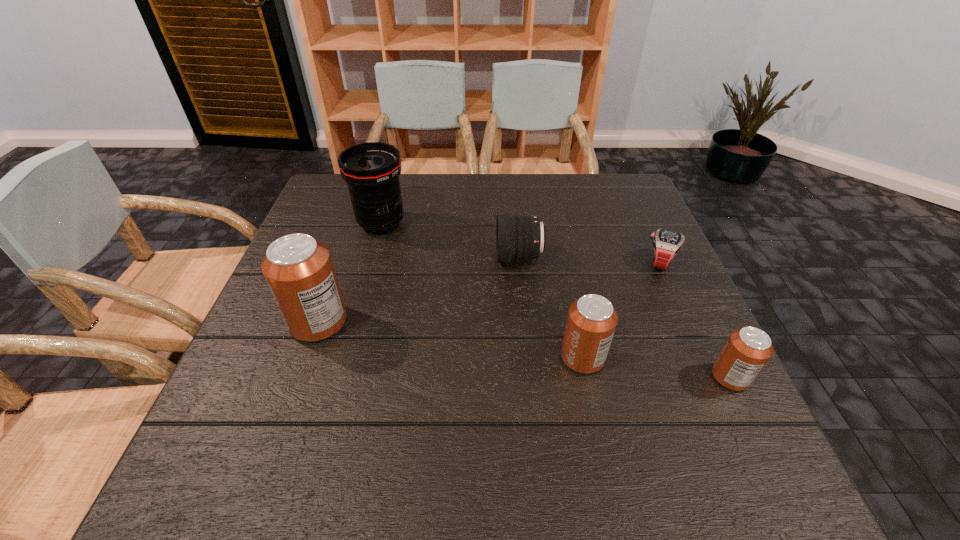
Identify the location of the tallest can. This screenshot has width=960, height=540. (298, 269).

Identify the location of the second shortest can. The width and height of the screenshot is (960, 540). (591, 322).

You are a GUI agent. You are given a task and a screenshot of the screen. Output one action in this format:
    pyautogui.click(x=<x>, y=<y>)
    Task: Click on the third tallest object
    
    Given the screenshot: What is the action you would take?
    pyautogui.click(x=591, y=322)

The image size is (960, 540). Identify the location of the rightmost can. (747, 350).

You are a GUI agent. You are given a task and a screenshot of the screen. Output one action in this format:
    pyautogui.click(x=<x>, y=<y>)
    Task: Click on the nearer telephoto lens
    This screenshot has height=540, width=960.
    Given the screenshot: What is the action you would take?
    pyautogui.click(x=518, y=237)

Identify the location of the shorter telephoto lens. The width and height of the screenshot is (960, 540). (518, 237).

At what (x,y) coordinates should I click in order to perform the action: click on the left telephoto lens. Please return your answer as a coordinate pair (x, y). This screenshot has width=960, height=540. Looking at the image, I should click on (371, 170).

Find the location of a particular element. The height and width of the screenshot is (540, 960). the farthest object is located at coordinates (371, 170).

The image size is (960, 540). In order to click on watch in this screenshot , I will do `click(667, 244)`.

Locate an element on the screen. This screenshot has height=540, width=960. vacant region located 0.110m on the front of the leftmost can is located at coordinates (295, 391).